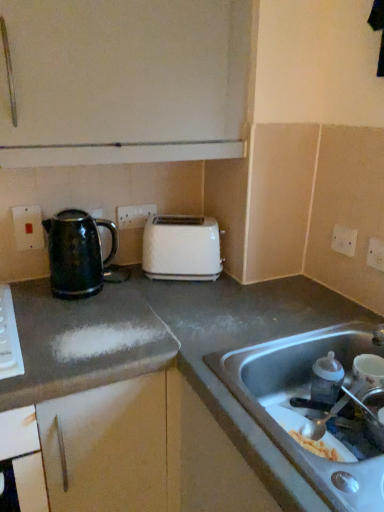
Question: Is white plastic electric outlet at center, placed as the second electric outlet when sorted from left to right, looking in the opposite direction of white plastic electric outlet at upper right, acting as the third electric outlet starting from the back?

Choices:
 (A) no
 (B) yes

Answer: (A)

Question: Does white plastic electric outlet at center, marked as the first electric outlet in a back-to-front arrangement, appear on the right side of white plastic electric outlet at upper right, which appears as the 3th electric outlet when viewed from the left?

Choices:
 (A) no
 (B) yes

Answer: (A)

Question: Considering the relative sizes of white plastic electric outlet at center, placed as the second electric outlet when sorted from left to right, and white plastic electric outlet at upper right, which is the second electric outlet in front-to-back order, in the image provided, is white plastic electric outlet at center, placed as the second electric outlet when sorted from left to right, thinner than white plastic electric outlet at upper right, which is the second electric outlet in front-to-back order,?

Choices:
 (A) no
 (B) yes

Answer: (A)

Question: Can you confirm if white plastic electric outlet at center, placed as the second electric outlet when sorted from left to right, is shorter than white plastic electric outlet at upper right, which is the second electric outlet in front-to-back order?

Choices:
 (A) no
 (B) yes

Answer: (A)

Question: Does white plastic electric outlet at center, marked as the first electric outlet in a back-to-front arrangement, have a greater height compared to white plastic electric outlet at upper right, which appears as the 3th electric outlet when viewed from the left?

Choices:
 (A) no
 (B) yes

Answer: (B)

Question: In terms of size, does white plastic electric outlet at upper right, marked as the 2th electric outlet in a right-to-left arrangement, appear bigger or smaller than white plastic electric outlet at center, placed as the second electric outlet when sorted from left to right?

Choices:
 (A) small
 (B) big

Answer: (A)

Question: Based on their positions, is white plastic electric outlet at upper right, which appears as the 3th electric outlet when viewed from the left, located to the left or right of white plastic electric outlet at center, the fourth electric outlet from the front?

Choices:
 (A) left
 (B) right

Answer: (B)

Question: Considering the positions of point (344, 232) and point (144, 211), is point (344, 232) closer or farther from the camera than point (144, 211)?

Choices:
 (A) farther
 (B) closer

Answer: (B)

Question: Is white plastic electric outlet at upper right, which appears as the 3th electric outlet when viewed from the left, situated inside white plastic electric outlet at center, the fourth electric outlet from the front, or outside?

Choices:
 (A) outside
 (B) inside

Answer: (A)

Question: From the image's perspective, is stainless steel sink at lower right above or below metallic silver faucet at sink right?

Choices:
 (A) below
 (B) above

Answer: (B)

Question: Is point (274, 426) positioned closer to the camera than point (362, 386)?

Choices:
 (A) closer
 (B) farther

Answer: (A)

Question: In terms of size, does stainless steel sink at lower right appear bigger or smaller than metallic silver faucet at sink right?

Choices:
 (A) small
 (B) big

Answer: (B)

Question: In terms of width, does stainless steel sink at lower right look wider or thinner when compared to metallic silver faucet at sink right?

Choices:
 (A) thin
 (B) wide

Answer: (B)

Question: From the image's perspective, is matte plastic electric outlet at upper left, which is counted as the second electric outlet, starting from the back, above or below white plastic electric outlet at upper right, positioned as the fourth electric outlet in back-to-front order?

Choices:
 (A) above
 (B) below

Answer: (A)

Question: From a real-world perspective, is matte plastic electric outlet at upper left, which is counted as the first electric outlet, starting from the left, physically located above or below white plastic electric outlet at upper right, marked as the first electric outlet in a front-to-back arrangement?

Choices:
 (A) below
 (B) above

Answer: (B)